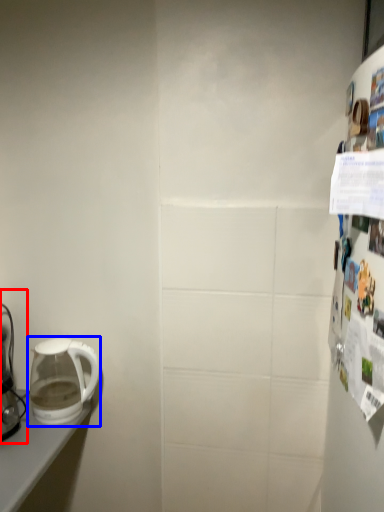
Question: Which object is further to the camera taking this photo, coffee maker (highlighted by a red box) or kettle (highlighted by a blue box)?

Choices:
 (A) coffee maker
 (B) kettle

Answer: (B)